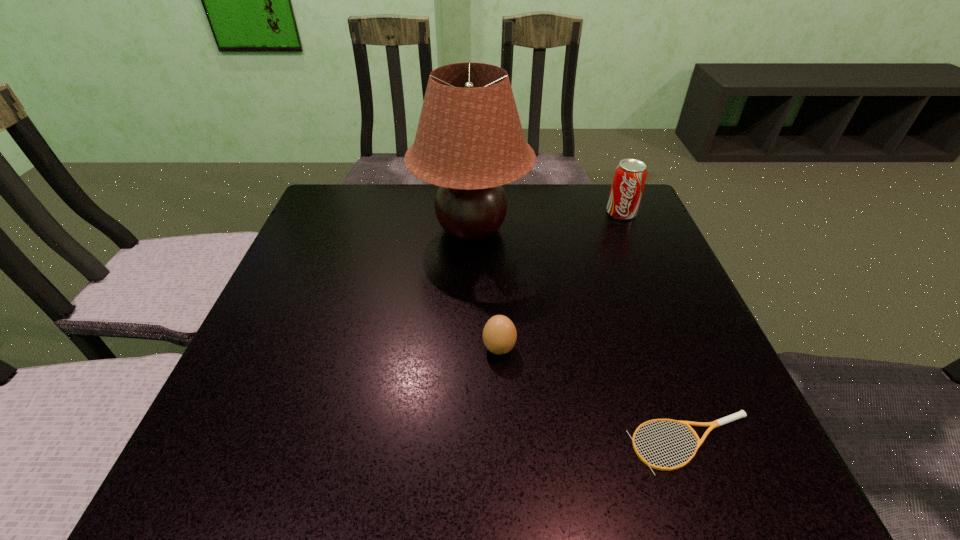
Identify the location of lampshade present at the far edge. Image resolution: width=960 pixels, height=540 pixels. 469,141.

You are a GUI agent. You are given a task and a screenshot of the screen. Output one action in this format:
    pyautogui.click(x=<x>, y=<y>)
    Task: Click on the soda can positioned at the far edge
    
    Given the screenshot: What is the action you would take?
    pyautogui.click(x=630, y=175)

You are a GUI agent. You are given a task and a screenshot of the screen. Output one action in this format:
    pyautogui.click(x=<x>, y=<y>)
    Task: Click on the object present at the near edge
    The image size is (960, 540).
    Given the screenshot: What is the action you would take?
    tap(741, 414)

Locate an element on the screen. soda can present at the right edge is located at coordinates (630, 175).

Locate an element on the screen. Image resolution: width=960 pixels, height=540 pixels. tennis racket located at the right edge is located at coordinates (741, 414).

Locate an element on the screen. object that is at the far right corner is located at coordinates (630, 175).

Locate an element on the screen. The width and height of the screenshot is (960, 540). object that is at the near right corner is located at coordinates (741, 414).

This screenshot has width=960, height=540. What are the coordinates of `vacant area at the far edge of the desktop` in the screenshot? It's located at (533, 210).

In the image, there is a desktop. Where is `vacant space at the near edge`? Image resolution: width=960 pixels, height=540 pixels. vacant space at the near edge is located at coordinates (368, 488).

Find the location of a particular element. The width and height of the screenshot is (960, 540). free space at the left edge is located at coordinates (362, 246).